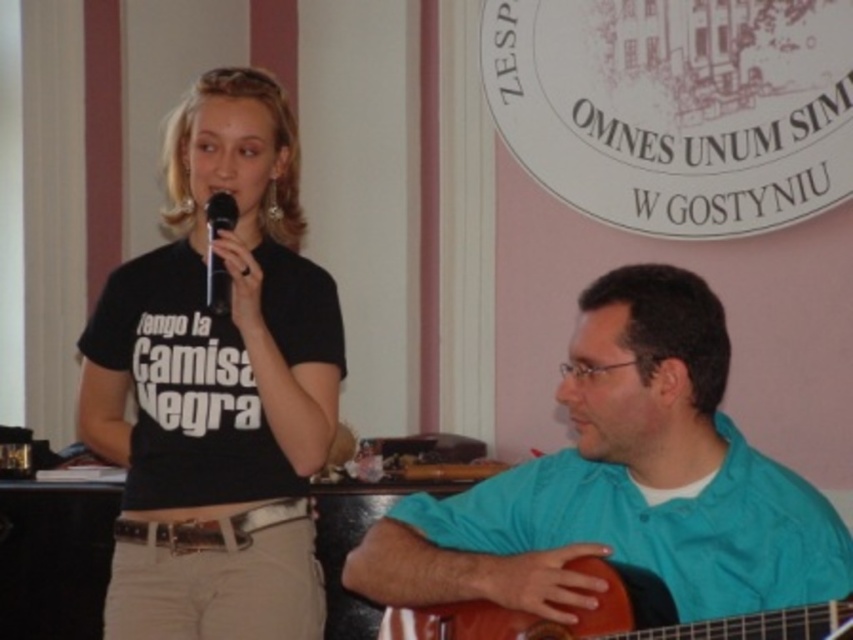
Is black matte t-shirt at center shorter than black plastic microphone at center?

In fact, black matte t-shirt at center may be taller than black plastic microphone at center.

Does black matte t-shirt at center have a greater width compared to black plastic microphone at center?

Indeed, black matte t-shirt at center has a greater width compared to black plastic microphone at center.

Who is more forward, (x=241, y=193) or (x=213, y=305)?

Point (x=213, y=305)

Locate an element on the screen. Image resolution: width=853 pixels, height=640 pixels. black matte t-shirt at center is located at coordinates (218, 387).

Does point (683, 548) come behind point (221, 195)?

No, it is not.

Does teal matte shirt at right have a smaller size compared to black plastic microphone at center?

Incorrect, teal matte shirt at right is not smaller in size than black plastic microphone at center.

Is point (529, 493) farther from camera compared to point (231, 211)?

No, (529, 493) is in front of (231, 211).

The width and height of the screenshot is (853, 640). Identify the location of teal matte shirt at right. (624, 484).

Does black matte t-shirt at center come in front of teal matte shirt at right?

No, it is not.

Between point (289, 428) and point (608, 413), which one is positioned in front?

Point (608, 413)

Locate an element on the screen. black matte t-shirt at center is located at coordinates (218, 387).